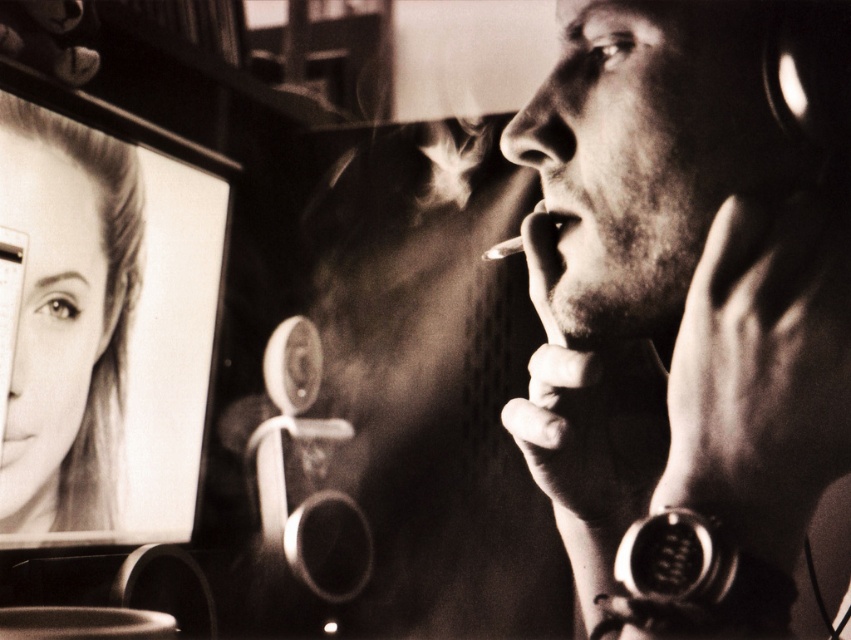
At what (x,y) coordinates should I click in order to perform the action: click on smooth skin face at right. Please return your answer as a coordinate pair (x, y). The width and height of the screenshot is (851, 640). Looking at the image, I should click on (688, 301).

Between smooth skin face at right and smooth skin mouth at center, which one has more height?

smooth skin face at right is taller.

What do you see at coordinates (688, 301) in the screenshot? I see `smooth skin face at right` at bounding box center [688, 301].

Where is `smooth skin face at right`? This screenshot has height=640, width=851. smooth skin face at right is located at coordinates (688, 301).

Can you confirm if smooth skin face at right is positioned below smooth skin face at upper left?

No.

At what (x,y) coordinates should I click in order to perform the action: click on smooth skin face at right. Please return your answer as a coordinate pair (x, y). The width and height of the screenshot is (851, 640). Looking at the image, I should click on (688, 301).

Identify the location of smooth skin face at right. The image size is (851, 640). (688, 301).

Where is `smooth skin face at upper left`? This screenshot has width=851, height=640. smooth skin face at upper left is located at coordinates (67, 312).

In the scene shown: Can you confirm if smooth skin face at upper left is positioned to the left of smooth skin mouth at center?

Incorrect, smooth skin face at upper left is not on the left side of smooth skin mouth at center.

Identify the location of smooth skin face at upper left. Image resolution: width=851 pixels, height=640 pixels. pyautogui.click(x=67, y=312).

The width and height of the screenshot is (851, 640). I want to click on smooth skin face at upper left, so click(x=67, y=312).